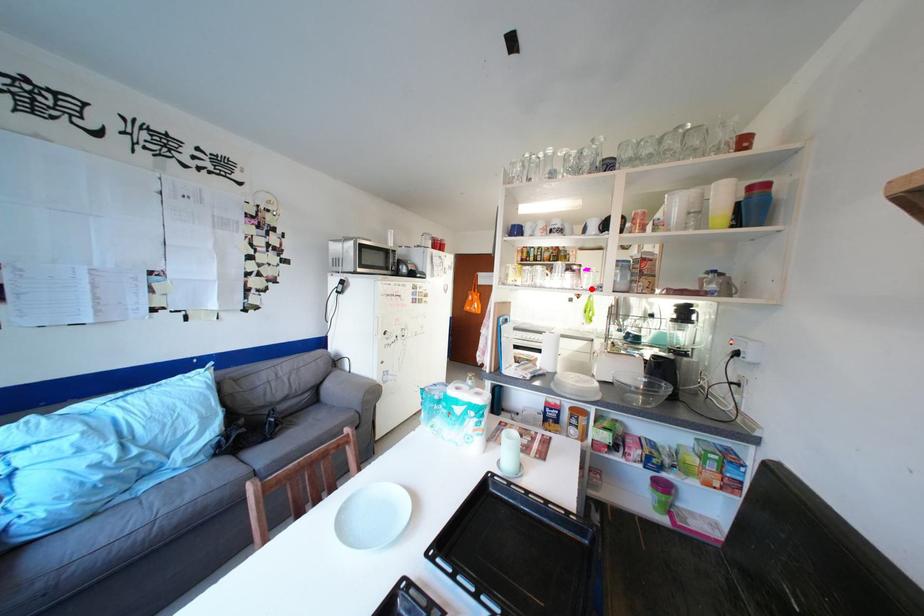
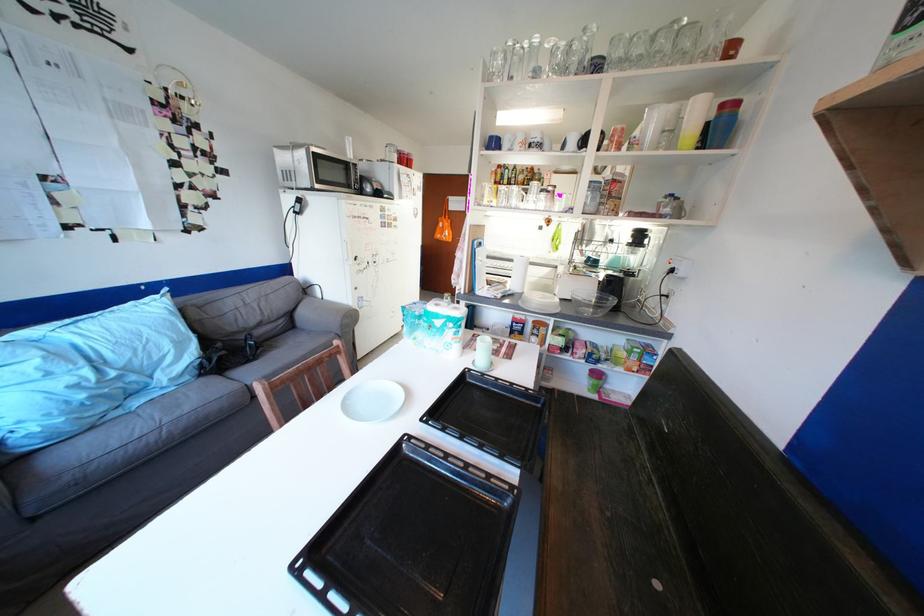
Question: I am providing you with two images of the same scene from different viewpoints. Image1 has a red point marked. In image2, the corresponding 3D location appears at what relative position? Reply with the corresponding letter.

Choices:
 (A) Closer
 (B) Farther

Answer: (A)